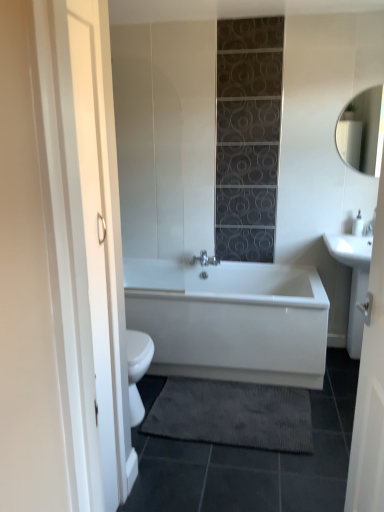
Question: Does dark gray textured bath mat at lower center have a lesser height compared to silver metallic faucet at right?

Choices:
 (A) yes
 (B) no

Answer: (A)

Question: From the image's perspective, would you say dark gray textured bath mat at lower center is positioned over silver metallic faucet at right?

Choices:
 (A) yes
 (B) no

Answer: (B)

Question: Is dark gray textured bath mat at lower center facing towards silver metallic faucet at right?

Choices:
 (A) no
 (B) yes

Answer: (A)

Question: Does dark gray textured bath mat at lower center have a lesser width compared to silver metallic faucet at right?

Choices:
 (A) yes
 (B) no

Answer: (B)

Question: From a real-world perspective, is dark gray textured bath mat at lower center located higher than silver metallic faucet at right?

Choices:
 (A) no
 (B) yes

Answer: (A)

Question: Is dark gray textured bath mat at lower center in front of silver metallic faucet at right?

Choices:
 (A) no
 (B) yes

Answer: (B)

Question: Is matte white mirror at upper right outside white glossy sink at right?

Choices:
 (A) yes
 (B) no

Answer: (A)

Question: Is matte white mirror at upper right not close to white glossy sink at right?

Choices:
 (A) no
 (B) yes

Answer: (A)

Question: Can you confirm if matte white mirror at upper right is shorter than white glossy sink at right?

Choices:
 (A) no
 (B) yes

Answer: (B)

Question: Can you confirm if matte white mirror at upper right is wider than white glossy sink at right?

Choices:
 (A) no
 (B) yes

Answer: (A)

Question: Can you confirm if matte white mirror at upper right is smaller than white glossy sink at right?

Choices:
 (A) yes
 (B) no

Answer: (A)

Question: From the image's perspective, is matte white mirror at upper right above white glossy sink at right?

Choices:
 (A) yes
 (B) no

Answer: (A)

Question: Is silver metallic faucet at right thinner than white glossy bathtub at center?

Choices:
 (A) yes
 (B) no

Answer: (A)